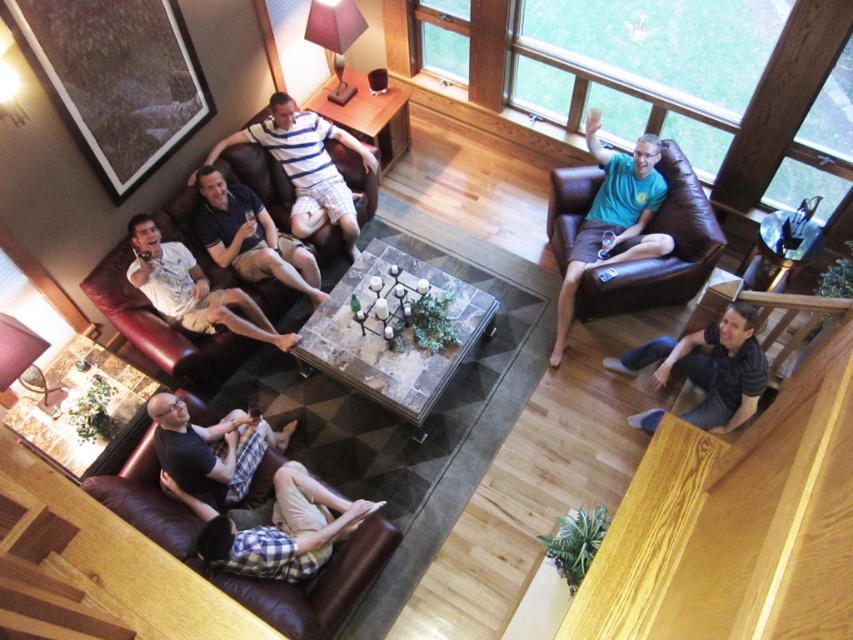
Question: Which point is closer to the camera taking this photo?

Choices:
 (A) (213, 196)
 (B) (238, 148)
 (C) (624, 220)
 (D) (281, 136)

Answer: (A)

Question: Which point appears farthest from the camera in this image?

Choices:
 (A) (664, 365)
 (B) (315, 618)

Answer: (A)

Question: Where is brown leather couch at lower left located in relation to matte black shirt at left in the image?

Choices:
 (A) right
 (B) left

Answer: (A)

Question: Can you confirm if dark gray fabric couch at lower left is smaller than matte black shirt at left?

Choices:
 (A) no
 (B) yes

Answer: (A)

Question: Considering the relative positions of plaid fabric shirt at lower left and teal fabric shirt at upper right in the image provided, where is plaid fabric shirt at lower left located with respect to teal fabric shirt at upper right?

Choices:
 (A) above
 (B) below

Answer: (B)

Question: Among these points, which one is nearest to the camera?

Choices:
 (A) (299, 220)
 (B) (230, 211)

Answer: (B)